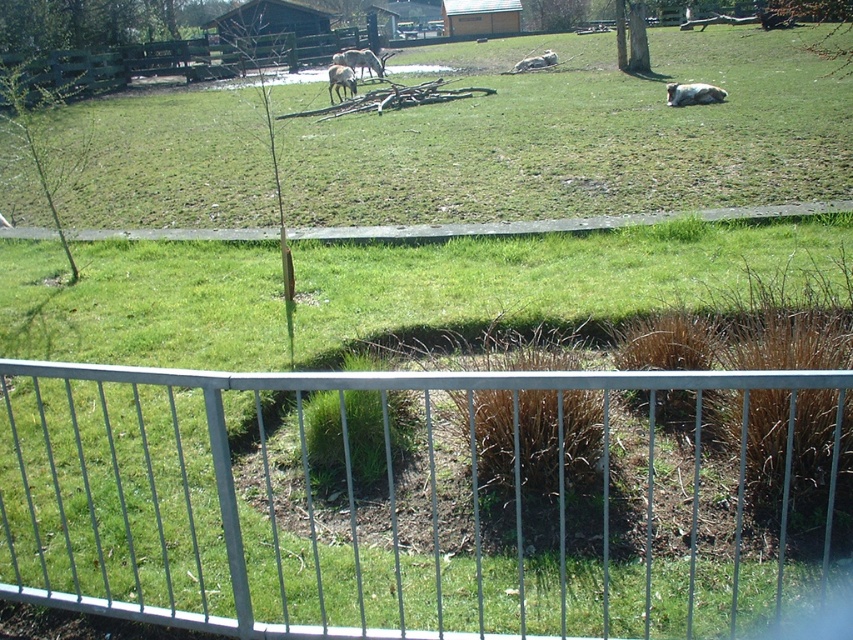
Question: Is white fur horse at center positioned before white fur animal at upper center?

Choices:
 (A) yes
 (B) no

Answer: (A)

Question: Does green wooden fence at upper center lie behind white fur animal at upper center?

Choices:
 (A) yes
 (B) no

Answer: (B)

Question: From the image, what is the correct spatial relationship of silver metallic fence at lower center in relation to white woolly sheep at upper center?

Choices:
 (A) left
 (B) right

Answer: (A)

Question: Which of the following is the farthest from the observer?

Choices:
 (A) white fur animal at upper center
 (B) white woolly sheep at upper center
 (C) green wooden fence at upper center
 (D) white fur horse at center

Answer: (A)

Question: Which is nearer to the white woolly sheep at center?

Choices:
 (A) white fur horse at center
 (B) silver metallic fence at lower center
 (C) green wooden fence at upper center
 (D) white woolly sheep at upper center

Answer: (A)

Question: Which point is closer to the camera taking this photo?

Choices:
 (A) (688, 96)
 (B) (84, 67)
 (C) (332, 80)
 (D) (541, 54)

Answer: (A)